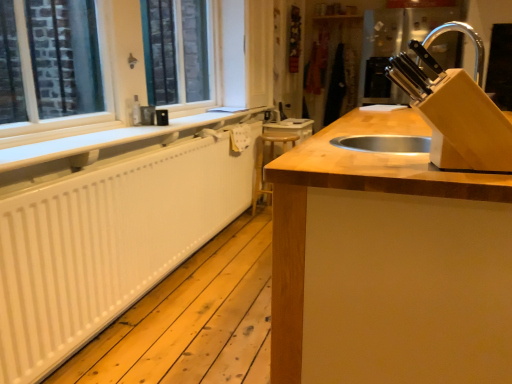
Describe the element at coordinates (383, 259) in the screenshot. I see `wooden at center` at that location.

At what (x,y) coordinates should I click in order to perform the action: click on white painted wood at left. Please return your answer as a coordinate pair (x, y). Looking at the image, I should click on (136, 91).

The image size is (512, 384). Describe the element at coordinates (136, 91) in the screenshot. I see `white painted wood at left` at that location.

The height and width of the screenshot is (384, 512). Find the location of `wooden at center`. wooden at center is located at coordinates (269, 161).

Find the location of a particular element. white matte radiator at left is located at coordinates (106, 243).

Considering the sizes of wooden at center and white painted wood at left in the image, is wooden at center taller or shorter than white painted wood at left?

Considering their sizes, wooden at center has more height than white painted wood at left.

From the image's perspective, is wooden at center under white painted wood at left?

Yes, from the image's perspective, wooden at center is beneath white painted wood at left.

Does point (330, 323) come behind point (137, 96)?

That is False.

From the image's perspective, between wooden at center and white matte radiator at left, who is located below?

From the image's view, wooden at center is below.

Would you say wooden at center is outside white matte radiator at left?

Indeed, wooden at center is completely outside white matte radiator at left.

How much distance is there between wooden at center and white matte radiator at left?

They are 1.14 meters apart.

Is point (462, 256) positioned in front of point (47, 318)?

Yes, point (462, 256) is closer to viewer.

Who is bigger, white matte radiator at left or wooden at center?

With larger size is white matte radiator at left.

Relative to wooden at center, is white matte radiator at left in front or behind?

white matte radiator at left is positioned closer to the viewer than wooden at center.

Is white matte radiator at left positioned far away from wooden at center?

Yes.

From the image's perspective, between white matte radiator at left and wooden at center, who is located below?

wooden at center.

Considering the relative sizes of white matte radiator at left and white matte radiator at left in the image provided, is white matte radiator at left wider than white matte radiator at left?

No, white matte radiator at left is not wider than white matte radiator at left.

Which is closer to the camera, (12, 207) or (64, 156)?

Point (12, 207).

Which object is positioned more to the right, white matte radiator at left or white matte radiator at left?

white matte radiator at left is more to the right.

Considering the relative sizes of white matte radiator at left and white matte radiator at left in the image provided, is white matte radiator at left taller than white matte radiator at left?

Indeed, white matte radiator at left has a greater height compared to white matte radiator at left.

From a real-world perspective, is white painted wood at left positioned over wooden at center based on gravity?

Correct, in the physical world, white painted wood at left is higher than wooden at center.

What are the coordinates of `window frame above the wooden at center (from the image's perspective)` in the screenshot? It's located at (136, 91).

Between white painted wood at left and wooden at center, which one is positioned behind?

white painted wood at left is further away from the camera.

Is wooden at center completely or partially inside white painted wood at left?

Definitely not — wooden at center is not inside white painted wood at left.

Considering the sizes of objects wooden at center and white painted wood at left in the image provided, who is taller, wooden at center or white painted wood at left?

white painted wood at left.

Is wooden at center with white painted wood at left?

No, wooden at center is not with white painted wood at left.

How different are the orientations of wooden at center and white painted wood at left in degrees?

The facing directions of wooden at center and white painted wood at left are 0.844 degrees apart.

Which is behind, point (255, 180) or point (104, 67)?

The point (255, 180) is farther.

Between white matte radiator at left and wooden at center, which one has larger size?

Bigger between the two is white matte radiator at left.

Is white matte radiator at left inside or outside of wooden at center?

white matte radiator at left is spatially situated outside wooden at center.

Does point (133, 169) lie in front of point (258, 154)?

Yes, it is in front of point (258, 154).

Considering the sizes of white matte radiator at left and wooden at center in the image, is white matte radiator at left wider or thinner than wooden at center?

Clearly, white matte radiator at left has less width compared to wooden at center.

At what (x,y) coordinates should I click in order to perform the action: click on countertop that is below the white painted wood at left (from the image's perspective). Please return your answer as a coordinate pair (x, y). Looking at the image, I should click on (383, 259).

You are a GUI agent. You are given a task and a screenshot of the screen. Output one action in this format:
    pyautogui.click(x=<x>, y=<y>)
    Task: Click on the radiator to the left of wooden at center
    Image resolution: width=512 pixels, height=384 pixels.
    Given the screenshot: What is the action you would take?
    pyautogui.click(x=106, y=243)

Which object lies nearer to the anchor point white matte radiator at left, white matte radiator at left or wooden at center?

white matte radiator at left.

Looking at the image, which one is located closer to wooden at center, white matte radiator at left or white painted wood at left?

white matte radiator at left is positioned closer to the anchor wooden at center.

From the image, which object appears to be nearer to wooden at center, white matte radiator at left or white matte radiator at left?

white matte radiator at left.

Estimate the real-world distances between objects in this image. Which object is closer to white matte radiator at left, white painted wood at left or wooden at center?

white painted wood at left is closer to white matte radiator at left.

Which object lies nearer to the anchor point wooden at center, white painted wood at left or wooden at center?

Among the two, white painted wood at left is located nearer to wooden at center.

From the image, which object appears to be farther from white matte radiator at left, wooden at center or white painted wood at left?

wooden at center.

Based on their spatial positions, is white matte radiator at left or wooden at center further from white painted wood at left?

Based on the image, wooden at center appears to be further to white painted wood at left.

Which object lies further to the anchor point white painted wood at left, wooden at center or white matte radiator at left?

wooden at center.

Where is `radiator situated between white matte radiator at left and wooden at center from left to right`? Image resolution: width=512 pixels, height=384 pixels. radiator situated between white matte radiator at left and wooden at center from left to right is located at coordinates (106, 243).

The height and width of the screenshot is (384, 512). Identify the location of window sill between white painted wood at left and wooden at center in the front-back direction. (104, 139).

At what (x,y) coordinates should I click in order to perform the action: click on radiator between wooden at center and wooden at center along the z-axis. Please return your answer as a coordinate pair (x, y). The height and width of the screenshot is (384, 512). Looking at the image, I should click on (106, 243).

Find the location of a particular element. window sill between white matte radiator at left and wooden at center along the z-axis is located at coordinates (104, 139).